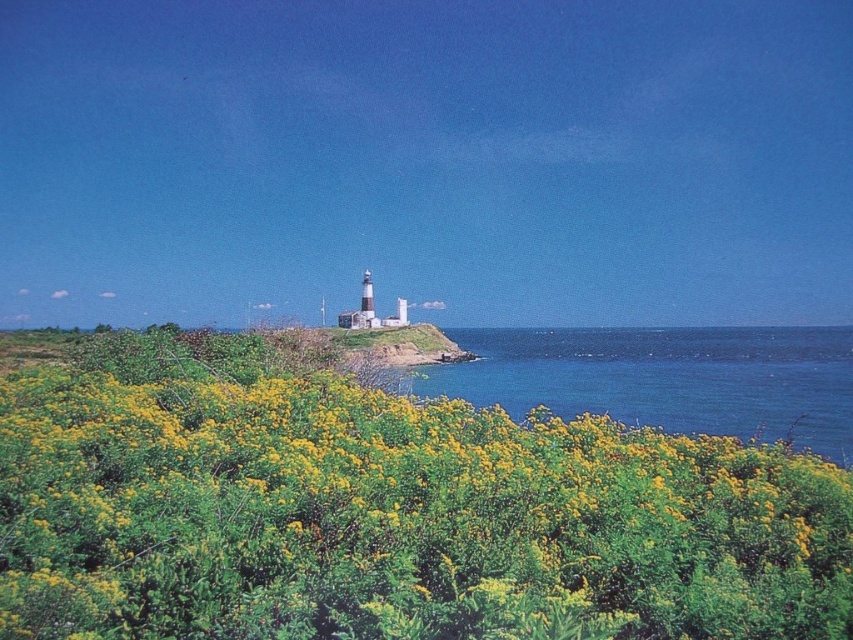
Question: Is green leafy shrubs at center wider than blue liquid water at center?

Choices:
 (A) no
 (B) yes

Answer: (A)

Question: Does green leafy shrubs at center appear over blue liquid water at center?

Choices:
 (A) yes
 (B) no

Answer: (A)

Question: Is green leafy shrubs at center positioned before blue liquid water at center?

Choices:
 (A) no
 (B) yes

Answer: (B)

Question: Which point appears farthest from the camera in this image?

Choices:
 (A) (729, 618)
 (B) (675, 400)

Answer: (B)

Question: Among these points, which one is farthest from the camera?

Choices:
 (A) (39, 596)
 (B) (751, 400)

Answer: (B)